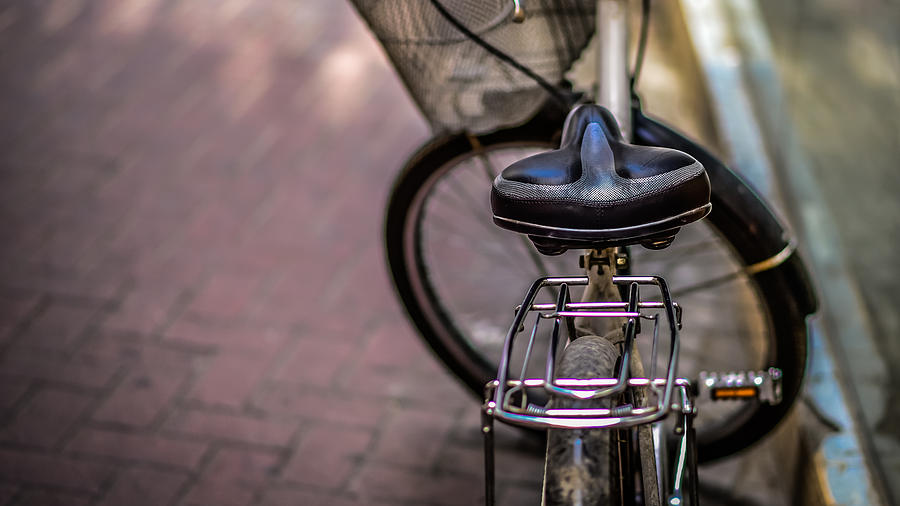
Where is `side edge corner`? side edge corner is located at coordinates (2, 215).